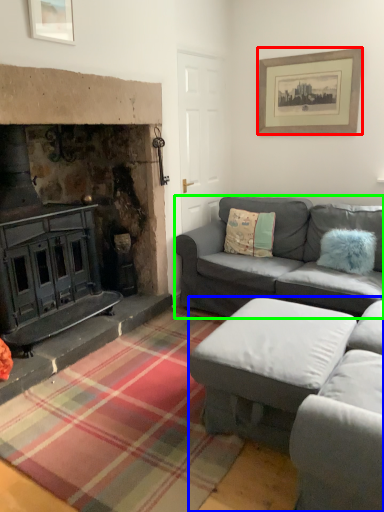
Question: Which is farther away from picture frame (highlighted by a red box)? studio couch (highlighted by a blue box) or studio couch (highlighted by a green box)?

Choices:
 (A) studio couch
 (B) studio couch

Answer: (A)